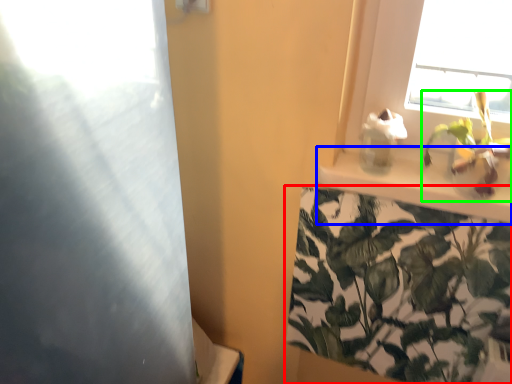
Question: Which object is positioned farthest from houseplant (highlighted by a red box)? Select from window sill (highlighted by a blue box) and houseplant (highlighted by a green box).

Choices:
 (A) window sill
 (B) houseplant

Answer: (B)